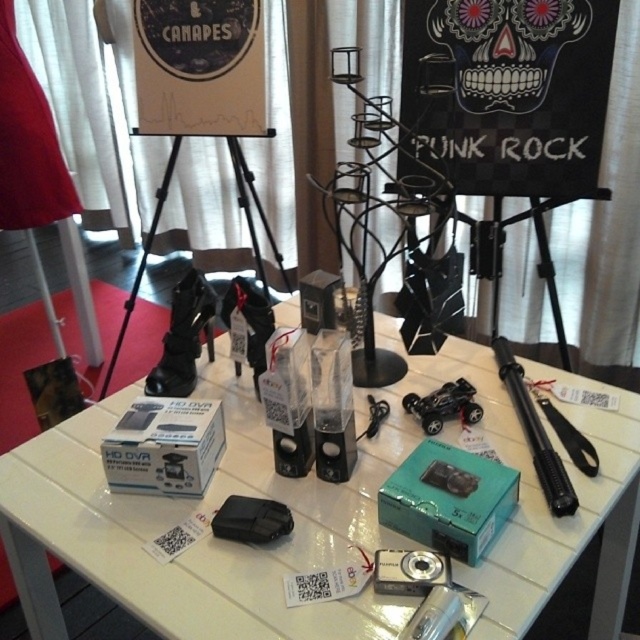
From the picture: You are setting up a promotional event and need to place a new sign between the white glossy table at center and the black matte skull at upper center. Based on their positions, which object should the sign be closer to?

The white glossy table at center is positioned on the left side of black matte skull at upper center, so the sign should be placed closer to the white glossy table at center.

You are setting up a display at an event and need to place a new item between the black matte skull at upper center and the black matte tripod at center. Based on their current positions, which side of the tripod should you place the new item to ensure it is between them?

The black matte skull at upper center is to the right of the black matte tripod at center, so placing the new item to the right side of the tripod would position it between the two objects.